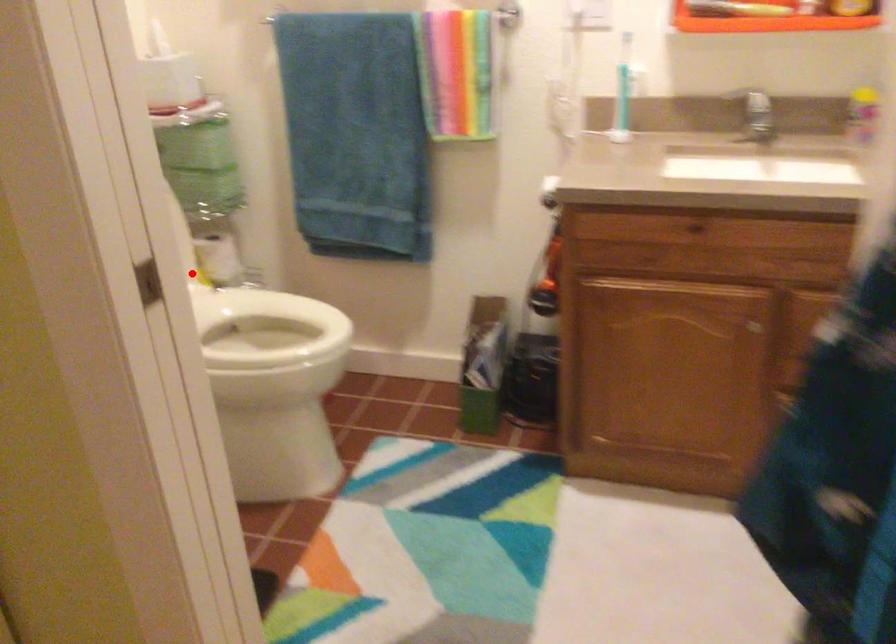
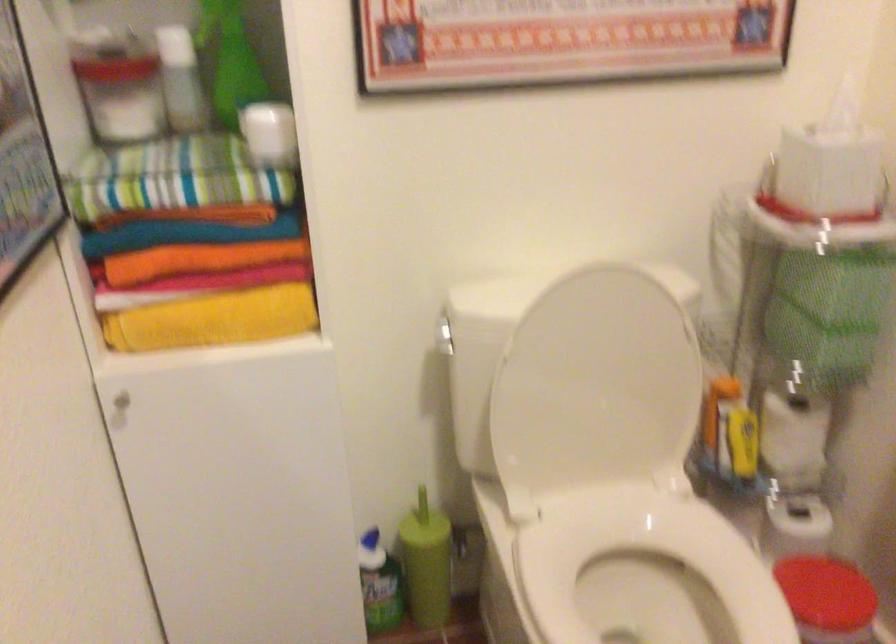
The point at the highlighted location is marked in the first image. Where is the corresponding point in the second image?

(743, 440)